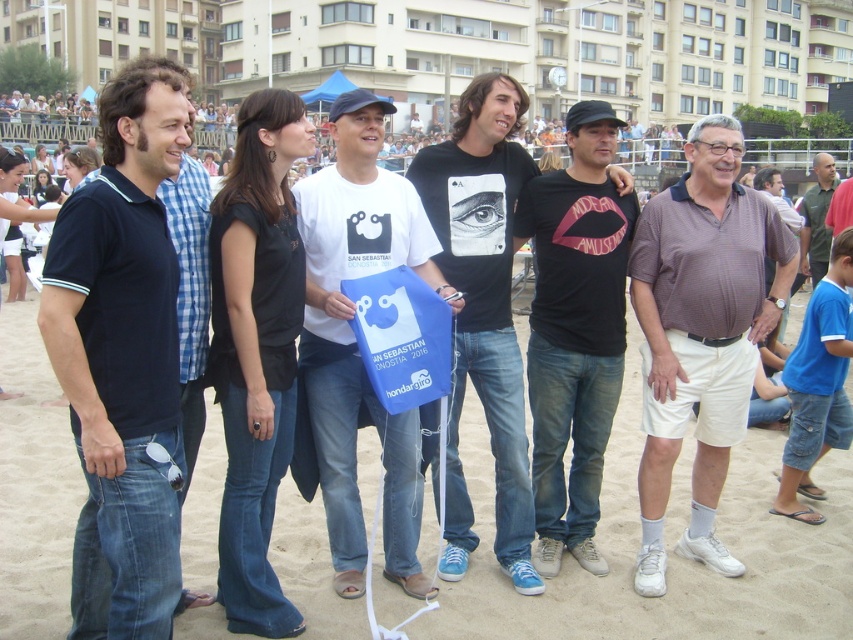
Who is positioned more to the left, dark blue polo shirt at left or green fabric shirt at center?

dark blue polo shirt at left

Is dark blue polo shirt at left to the right of green fabric shirt at center from the viewer's perspective?

In fact, dark blue polo shirt at left is to the left of green fabric shirt at center.

What do you see at coordinates (122, 360) in the screenshot? I see `dark blue polo shirt at left` at bounding box center [122, 360].

Locate an element on the screen. dark blue polo shirt at left is located at coordinates (122, 360).

Is dark blue polo shirt at left closer to the viewer compared to white cotton t-shirt at center?

Yes, it is.

In the scene shown: Between dark blue polo shirt at left and white cotton t-shirt at center, which one appears on the left side from the viewer's perspective?

Positioned to the left is dark blue polo shirt at left.

Image resolution: width=853 pixels, height=640 pixels. In order to click on dark blue polo shirt at left in this screenshot , I will do `click(122, 360)`.

This screenshot has width=853, height=640. I want to click on dark blue polo shirt at left, so click(x=122, y=360).

Is point (204, 460) closer to camera compared to point (776, 182)?

Yes.

How far apart are sandy beach at center and brown cotton shirt at center?

sandy beach at center and brown cotton shirt at center are 11.34 meters apart.

In order to click on sandy beach at center in this screenshot , I will do `click(666, 548)`.

Locate an element on the screen. Image resolution: width=853 pixels, height=640 pixels. sandy beach at center is located at coordinates (666, 548).